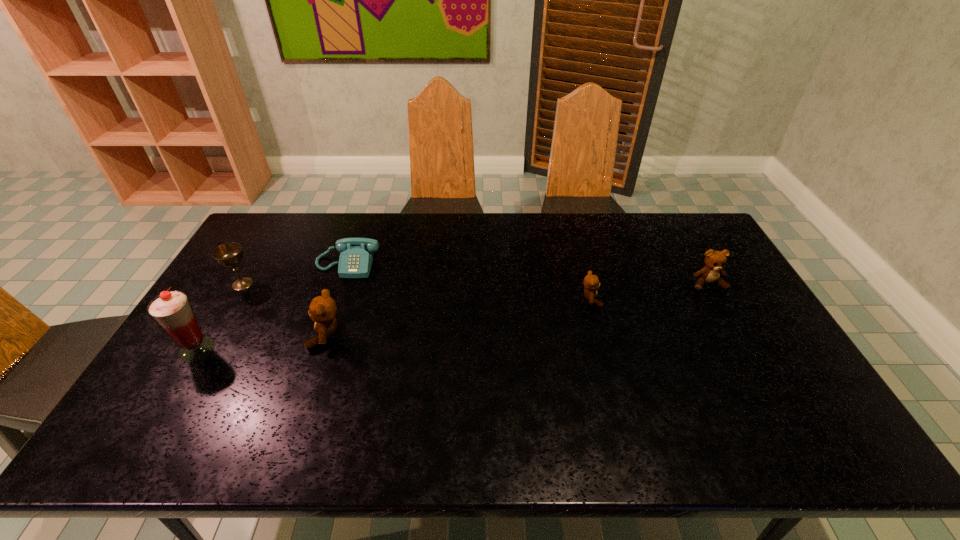
Where is `the tallest teddy bear`? This screenshot has height=540, width=960. the tallest teddy bear is located at coordinates (322, 310).

Locate an element on the screen. the nearest teddy bear is located at coordinates (322, 310).

The image size is (960, 540). What are the coordinates of `the fifth object from left to right` in the screenshot? It's located at (591, 282).

Find the location of a particular element. This screenshot has width=960, height=540. the second teddy bear from left to right is located at coordinates (591, 282).

This screenshot has width=960, height=540. In order to click on the second tallest teddy bear in this screenshot , I will do `click(715, 261)`.

I want to click on the rightmost teddy bear, so click(x=715, y=261).

Where is `chalice`? This screenshot has width=960, height=540. chalice is located at coordinates (229, 254).

What are the coordinates of `telephone` in the screenshot? It's located at (356, 256).

The height and width of the screenshot is (540, 960). What are the coordinates of `the tallest object` in the screenshot? It's located at coord(172,310).

You are a GUI agent. You are given a task and a screenshot of the screen. Output one action in this format:
    pyautogui.click(x=<x>, y=<y>)
    Task: Click on the free space located on the front-facing side of the nearest teddy bear
    
    Given the screenshot: What is the action you would take?
    pyautogui.click(x=254, y=335)